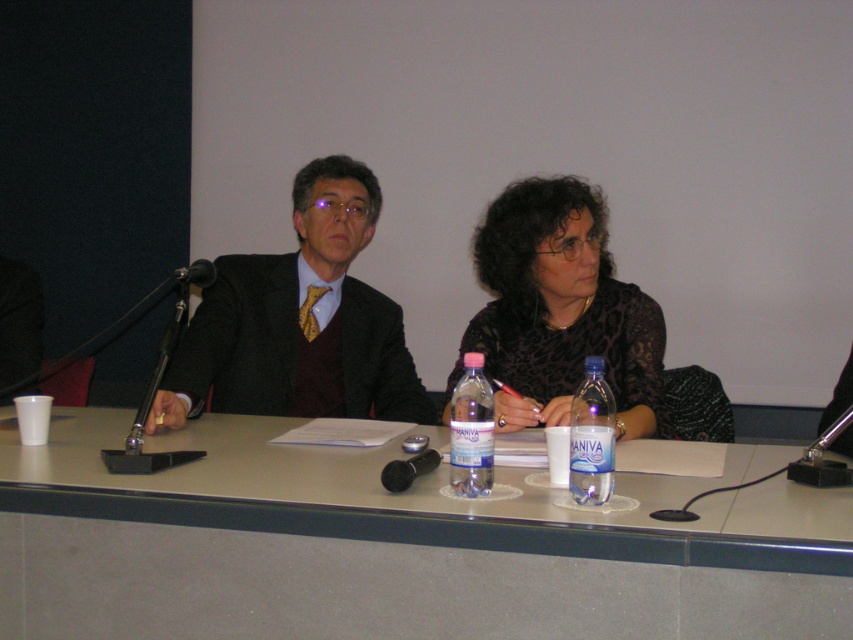
Question: Can you confirm if black lace shirt at center is smaller than dark gray wool suit at left?

Choices:
 (A) yes
 (B) no

Answer: (B)

Question: Which point appears farthest from the camera in this image?

Choices:
 (A) (424, 605)
 (B) (357, 340)

Answer: (B)

Question: Which point is farther to the camera?

Choices:
 (A) (515, 621)
 (B) (512, 304)
 (C) (477, 356)

Answer: (B)

Question: Which object is farther from the camera taking this photo?

Choices:
 (A) smooth gray table at center
 (B) black plastic microphone at center
 (C) black lace shirt at center

Answer: (C)

Question: Can you confirm if dark gray wool suit at left is positioned below black plastic microphone at center?

Choices:
 (A) no
 (B) yes

Answer: (A)

Question: Does black lace shirt at center have a greater width compared to transparent plastic bottle at center?

Choices:
 (A) no
 (B) yes

Answer: (B)